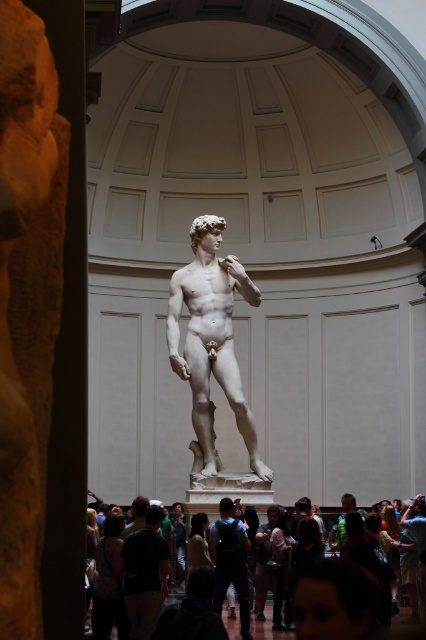
Question: Estimate the real-world distances between objects in this image. Which object is farther from the matte gray crowd at center?

Choices:
 (A) white marble statue at center
 (B) black fabric shirt at center
 (C) matte white statue at center

Answer: (A)

Question: Is matte gray crowd at center to the left of matte white statue at center from the viewer's perspective?

Choices:
 (A) no
 (B) yes

Answer: (A)

Question: Does white marble statue at center appear over black fabric shirt at center?

Choices:
 (A) yes
 (B) no

Answer: (A)

Question: Which object is the closest to the black fabric shirt at center?

Choices:
 (A) matte gray statue at center
 (B) white marble statue at center
 (C) matte gray crowd at center

Answer: (A)

Question: Estimate the real-world distances between objects in this image. Which object is closer to the matte gray statue at center?

Choices:
 (A) black fabric shirt at center
 (B) matte white statue at center
 (C) white marble statue at center

Answer: (A)

Question: Can you confirm if white marble statue at center is positioned to the right of matte white statue at center?

Choices:
 (A) no
 (B) yes

Answer: (A)